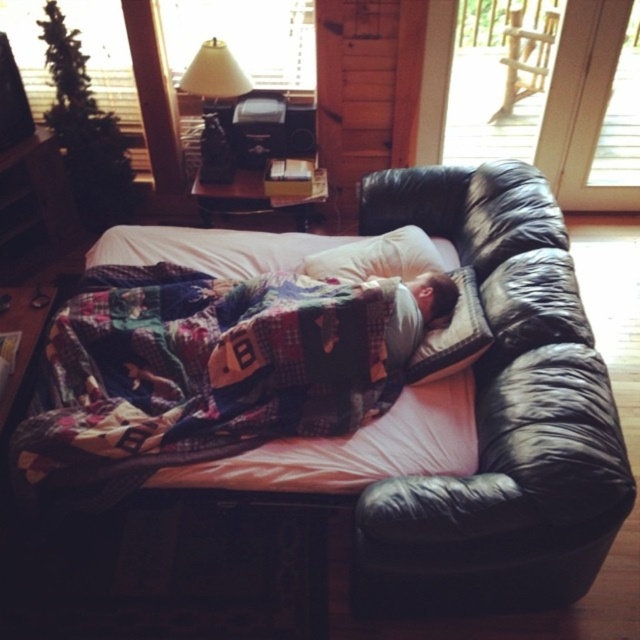
Which of these two, white soft pillow at center or matte black lamp at upper center, stands shorter?

With less height is white soft pillow at center.

Can you confirm if white soft pillow at center is shorter than matte black lamp at upper center?

Yes, white soft pillow at center is shorter than matte black lamp at upper center.

Measure the distance between white soft pillow at center and camera.

white soft pillow at center and camera are 2.26 meters apart.

Locate an element on the screen. Image resolution: width=640 pixels, height=640 pixels. white soft pillow at center is located at coordinates 376,257.

Who is positioned more to the right, white soft pillow at center or white soft pillow at upper center?

white soft pillow at upper center

Describe the element at coordinates (376, 257) in the screenshot. I see `white soft pillow at center` at that location.

Who is more forward, [442,268] or [472,276]?

Point [472,276] is more forward.

Identify the location of white soft pillow at center. The width and height of the screenshot is (640, 640). (376, 257).

In the scene shown: Is black leather couch at center further to camera compared to white soft pillow at center?

No.

Can you confirm if black leather couch at center is shorter than white soft pillow at center?

In fact, black leather couch at center may be taller than white soft pillow at center.

Find the location of a particular element. black leather couch at center is located at coordinates (390, 461).